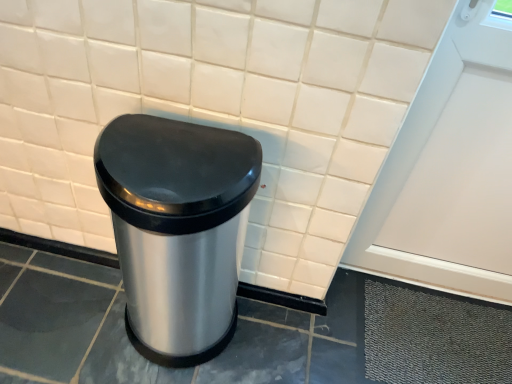
The height and width of the screenshot is (384, 512). What do you see at coordinates (450, 170) in the screenshot?
I see `white matte screen door at upper right` at bounding box center [450, 170].

The width and height of the screenshot is (512, 384). I want to click on white matte screen door at upper right, so click(x=450, y=170).

You are a GUI agent. You are given a task and a screenshot of the screen. Output one action in this format:
    pyautogui.click(x=<x>, y=<y>)
    Task: Click on the satin silver trash can at center
    
    Given the screenshot: What is the action you would take?
    pyautogui.click(x=177, y=230)

Describe the element at coordinates (177, 230) in the screenshot. I see `satin silver trash can at center` at that location.

The image size is (512, 384). I want to click on white matte screen door at upper right, so click(x=450, y=170).

Is satin silver trash can at center at the right side of white matte screen door at upper right?

No, satin silver trash can at center is not to the right of white matte screen door at upper right.

Relative to white matte screen door at upper right, is satin silver trash can at center in front or behind?

Visually, satin silver trash can at center is located in front of white matte screen door at upper right.

Which is in front, point (220, 206) or point (397, 210)?

Positioned in front is point (220, 206).

From the image's perspective, between satin silver trash can at center and white matte screen door at upper right, who is located below?

satin silver trash can at center.

From a real-world perspective, is satin silver trash can at center physically located above or below white matte screen door at upper right?

satin silver trash can at center is below white matte screen door at upper right.

Based on the photo, considering the sizes of objects satin silver trash can at center and white matte screen door at upper right in the image provided, who is wider, satin silver trash can at center or white matte screen door at upper right?

With larger width is satin silver trash can at center.

From the picture: Is satin silver trash can at center taller than white matte screen door at upper right?

Incorrect, the height of satin silver trash can at center is not larger of that of white matte screen door at upper right.

Which of these two, satin silver trash can at center or white matte screen door at upper right, is bigger?

Bigger between the two is satin silver trash can at center.

Is satin silver trash can at center inside or outside of white matte screen door at upper right?

satin silver trash can at center is located beyond the bounds of white matte screen door at upper right.

Are satin silver trash can at center and white matte screen door at upper right far apart?

satin silver trash can at center is actually quite close to white matte screen door at upper right.

Is satin silver trash can at center looking in the opposite direction of white matte screen door at upper right?

satin silver trash can at center is not turned away from white matte screen door at upper right.

How different are the orientations of satin silver trash can at center and white matte screen door at upper right in degrees?

0.578 degrees separate the facing orientations of satin silver trash can at center and white matte screen door at upper right.

In order to click on waste container located on the left of white matte screen door at upper right in this screenshot , I will do `click(177, 230)`.

In the image, is white matte screen door at upper right on the left side or the right side of satin silver trash can at center?

Based on their positions, white matte screen door at upper right is located to the right of satin silver trash can at center.

Which object is further away from the camera taking this photo, white matte screen door at upper right or satin silver trash can at center?

white matte screen door at upper right is further from the camera.

Which is nearer, (510, 112) or (188, 327)?

Point (510, 112).

From the image's perspective, between white matte screen door at upper right and satin silver trash can at center, which one is located above?

white matte screen door at upper right is shown above in the image.

From a real-world perspective, relative to satin silver trash can at center, is white matte screen door at upper right vertically above or below?

In terms of real-world spatial position, white matte screen door at upper right is above satin silver trash can at center.

Is white matte screen door at upper right wider than satin silver trash can at center?

Incorrect, the width of white matte screen door at upper right does not surpass that of satin silver trash can at center.

Can you confirm if white matte screen door at upper right is taller than satin silver trash can at center?

Indeed, white matte screen door at upper right has a greater height compared to satin silver trash can at center.

Who is bigger, white matte screen door at upper right or satin silver trash can at center?

With larger size is satin silver trash can at center.

Is satin silver trash can at center surrounded by white matte screen door at upper right?

No, satin silver trash can at center is not a part of white matte screen door at upper right.

Are white matte screen door at upper right and satin silver trash can at center far apart?

No.

Does white matte screen door at upper right turn towards satin silver trash can at center?

No, white matte screen door at upper right is not oriented towards satin silver trash can at center.

From the picture: What's the angular difference between white matte screen door at upper right and satin silver trash can at center's facing directions?

The angular difference between white matte screen door at upper right and satin silver trash can at center is 0.578 degrees.

The image size is (512, 384). What are the coordinates of `waste container on the left of white matte screen door at upper right` in the screenshot? It's located at (177, 230).

Image resolution: width=512 pixels, height=384 pixels. I want to click on waste container to the left of white matte screen door at upper right, so click(x=177, y=230).

In order to click on waste container in front of the white matte screen door at upper right in this screenshot , I will do `click(177, 230)`.